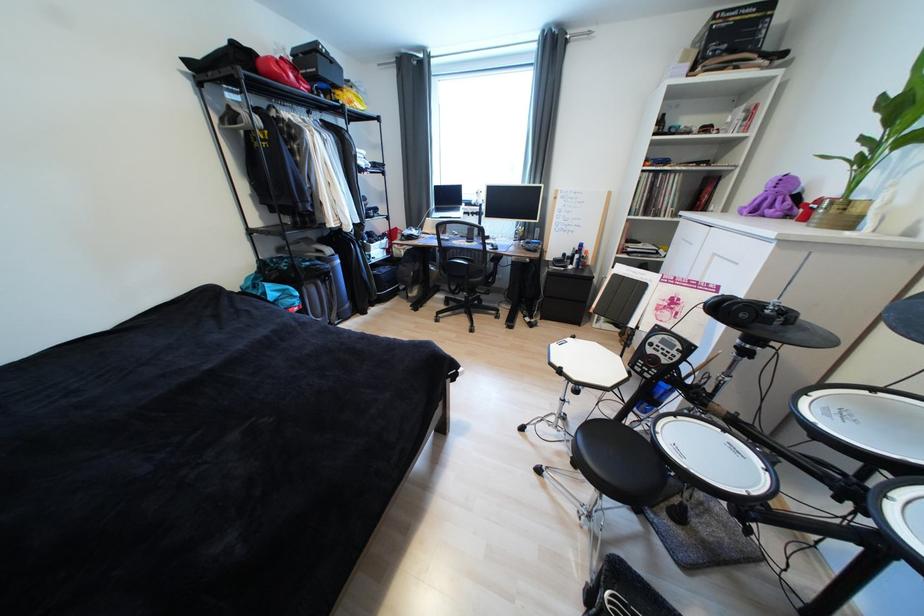
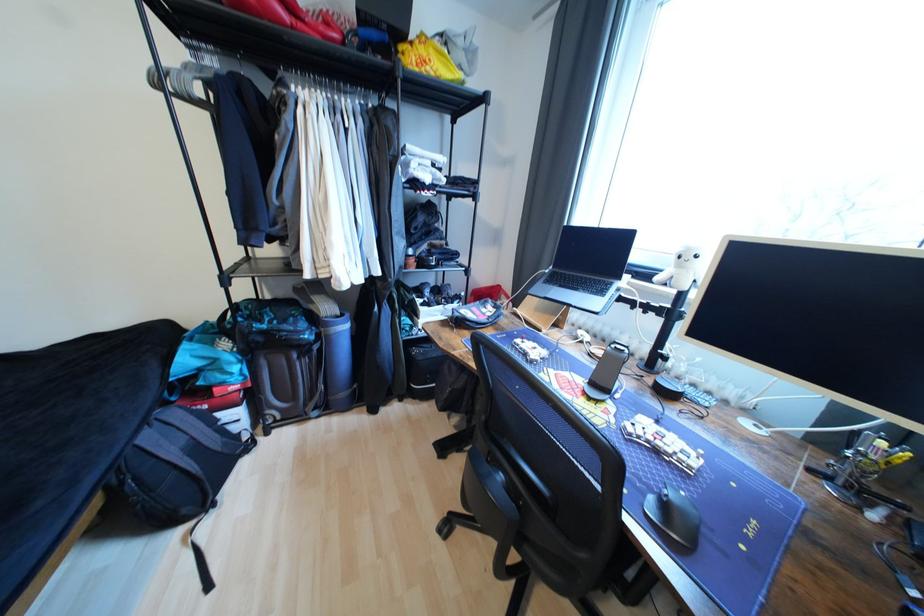
In the second image, find the point that corresponds to the point at 480,204 in the first image.

(663, 280)